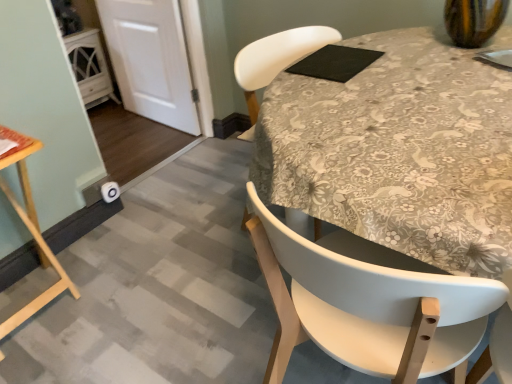
This screenshot has height=384, width=512. I want to click on space that is in front of black matte pad at upper center, so click(337, 80).